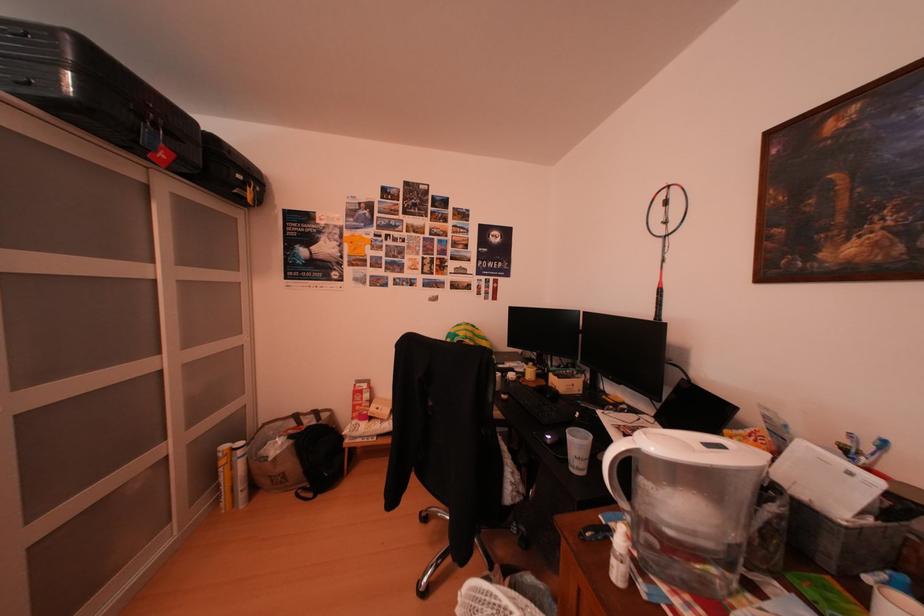
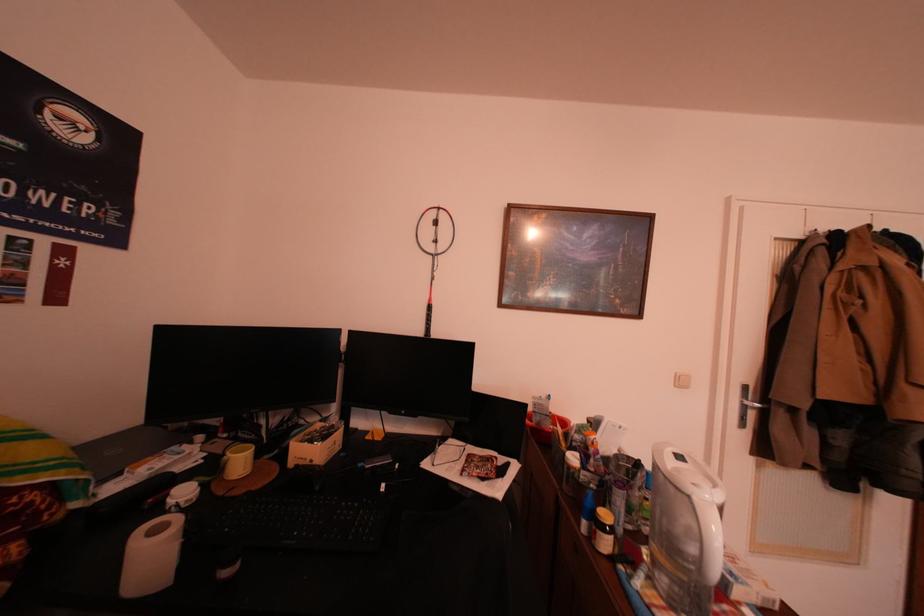
Question: The camera is either moving clockwise (left) or counter-clockwise (right) around the object. The first image is from the beginning of the video and the second image is from the end. Is the camera moving left or right when shooting the video?

Choices:
 (A) Left
 (B) Right

Answer: (A)